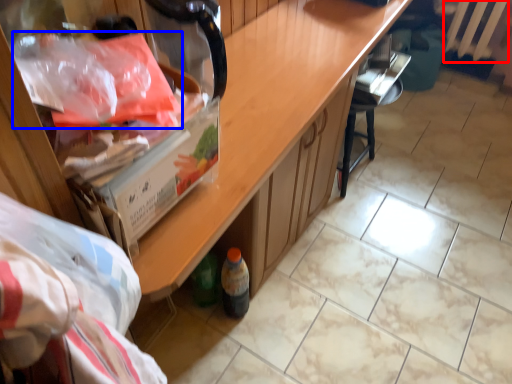
Question: Which object appears farthest to the camera in this image, radiator (highlighted by a red box) or material (highlighted by a blue box)?

Choices:
 (A) radiator
 (B) material

Answer: (A)